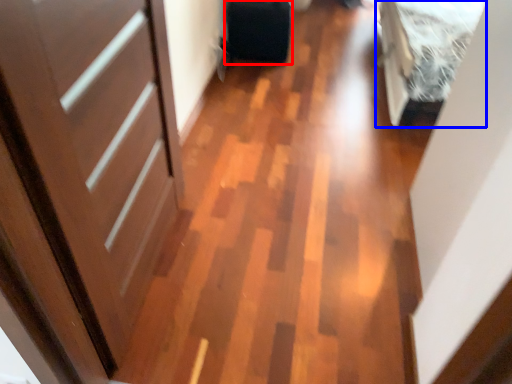
Question: Which of the following is the farthest to the observer, luggage (highlighted by a red box) or bed (highlighted by a blue box)?

Choices:
 (A) luggage
 (B) bed

Answer: (A)